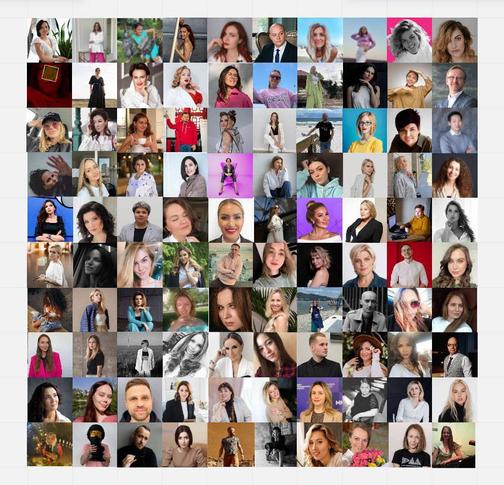
Find the location of a particular element. individual pictures on the bottom row is located at coordinates (53, 438), (94, 439), (142, 446), (189, 444), (234, 441), (276, 441), (320, 441), (366, 438), (410, 436), (446, 436).